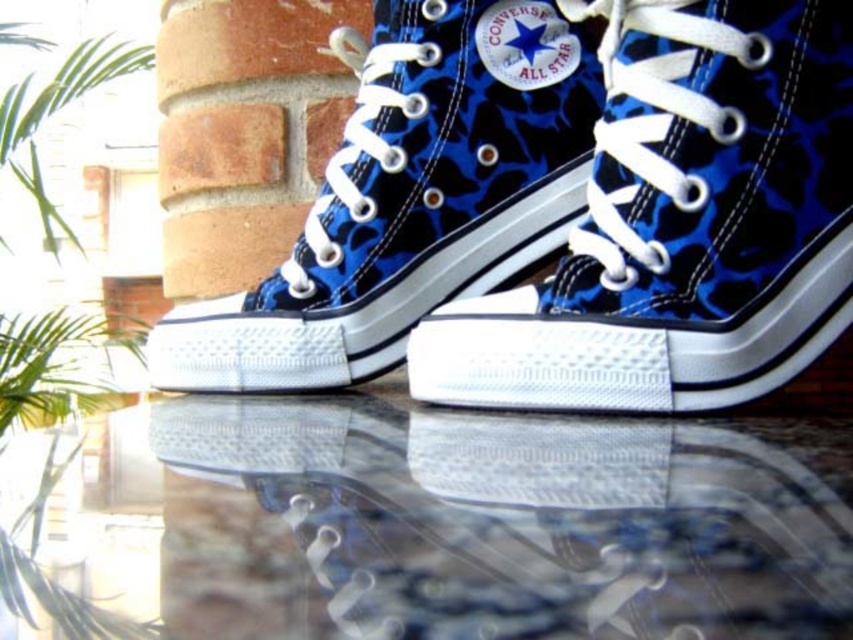
Which is below, transparent glass table at center or blue camouflage fabric converse all star at center?

Positioned lower is transparent glass table at center.

Is transparent glass table at center further to camera compared to blue camouflage fabric converse all star at center?

No, it is not.

Which is in front, point (421, 416) or point (457, 344)?

Point (457, 344) is more forward.

Where is `transparent glass table at center`? The width and height of the screenshot is (853, 640). transparent glass table at center is located at coordinates (471, 522).

Between point (210, 388) and point (7, 394), which one is positioned behind?

Positioned behind is point (7, 394).

Looking at this image, which is more to the left, blue canvas converse all star at center or green leafy plant at upper left?

green leafy plant at upper left is more to the left.

Who is more forward, [503,54] or [30,170]?

Point [503,54] is more forward.

The width and height of the screenshot is (853, 640). I want to click on blue canvas converse all star at center, so click(x=410, y=196).

Is blue camouflage fabric converse all star at center to the right of green leafy plant at upper left from the viewer's perspective?

Indeed, blue camouflage fabric converse all star at center is positioned on the right side of green leafy plant at upper left.

Does blue camouflage fabric converse all star at center have a lesser width compared to green leafy plant at upper left?

Correct, blue camouflage fabric converse all star at center's width is less than green leafy plant at upper left's.

Is point (807, 349) farther from camera compared to point (148, 51)?

No, it is not.

Locate an element on the screen. blue camouflage fabric converse all star at center is located at coordinates (682, 224).